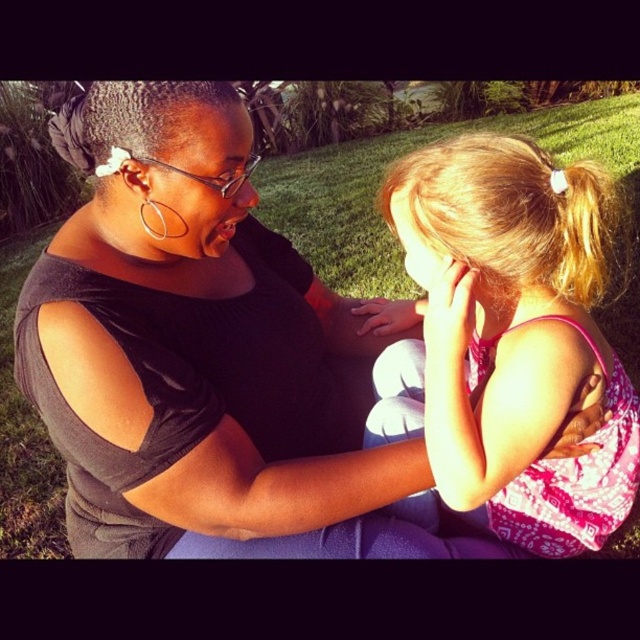
Does pink fabric dress at center appear over green grass at center?

Correct, pink fabric dress at center is located above green grass at center.

Is point (413, 209) less distant than point (292, 420)?

Yes, it is in front of point (292, 420).

The width and height of the screenshot is (640, 640). Identify the location of pink fabric dress at center. (508, 339).